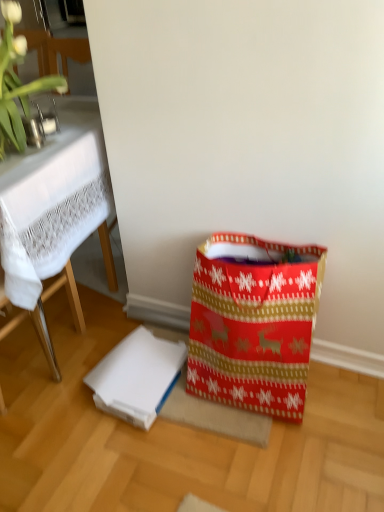
Question: Is red paper shopping bag at lower right wider than white matte cardboard box at lower center?

Choices:
 (A) no
 (B) yes

Answer: (B)

Question: Can you confirm if red paper shopping bag at lower right is positioned to the left of white matte cardboard box at lower center?

Choices:
 (A) yes
 (B) no

Answer: (B)

Question: Is red paper shopping bag at lower right not inside white matte cardboard box at lower center?

Choices:
 (A) yes
 (B) no

Answer: (A)

Question: Is the depth of red paper shopping bag at lower right greater than that of white matte cardboard box at lower center?

Choices:
 (A) yes
 (B) no

Answer: (B)

Question: Are red paper shopping bag at lower right and white matte cardboard box at lower center making contact?

Choices:
 (A) no
 (B) yes

Answer: (A)

Question: From the image's perspective, is red paper shopping bag at lower right positioned above or below white matte cardboard box at lower center?

Choices:
 (A) above
 (B) below

Answer: (A)

Question: In terms of width, does red paper shopping bag at lower right look wider or thinner when compared to white matte cardboard box at lower center?

Choices:
 (A) thin
 (B) wide

Answer: (B)

Question: From a real-world perspective, is red paper shopping bag at lower right positioned above or below white matte cardboard box at lower center?

Choices:
 (A) above
 (B) below

Answer: (A)

Question: Is red paper shopping bag at lower right taller or shorter than white matte cardboard box at lower center?

Choices:
 (A) tall
 (B) short

Answer: (A)

Question: Is white lace tablecloth at upper left situated inside white matte cardboard box at lower center or outside?

Choices:
 (A) inside
 (B) outside

Answer: (B)

Question: Visually, is white lace tablecloth at upper left positioned to the left or to the right of white matte cardboard box at lower center?

Choices:
 (A) left
 (B) right

Answer: (A)

Question: Considering their positions, is white lace tablecloth at upper left located in front of or behind white matte cardboard box at lower center?

Choices:
 (A) behind
 (B) front

Answer: (B)

Question: In terms of size, does white lace tablecloth at upper left appear bigger or smaller than white matte cardboard box at lower center?

Choices:
 (A) big
 (B) small

Answer: (A)

Question: Visually, is white matte cardboard box at lower center positioned to the left or to the right of green leafy plant at upper left?

Choices:
 (A) left
 (B) right

Answer: (B)

Question: In terms of height, does white matte cardboard box at lower center look taller or shorter compared to green leafy plant at upper left?

Choices:
 (A) tall
 (B) short

Answer: (B)